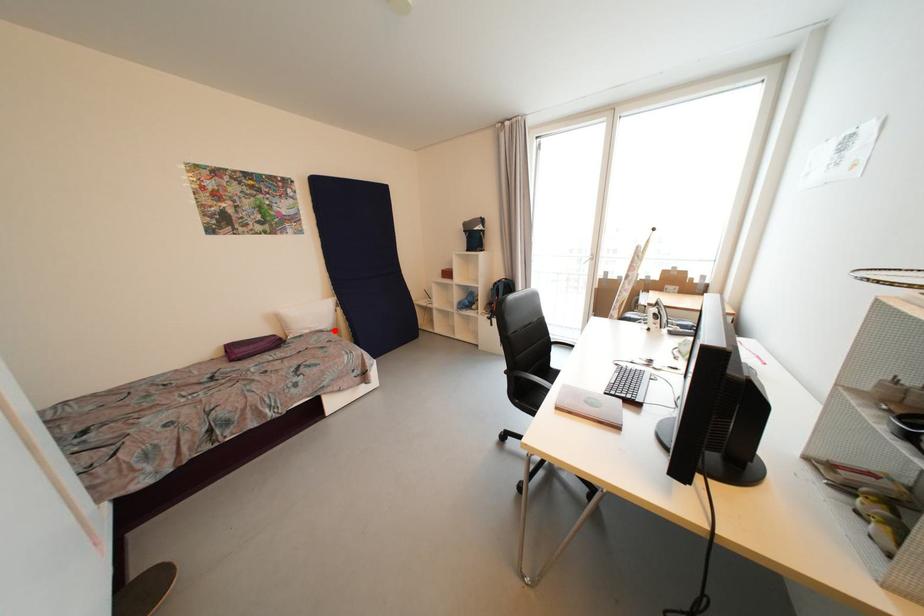
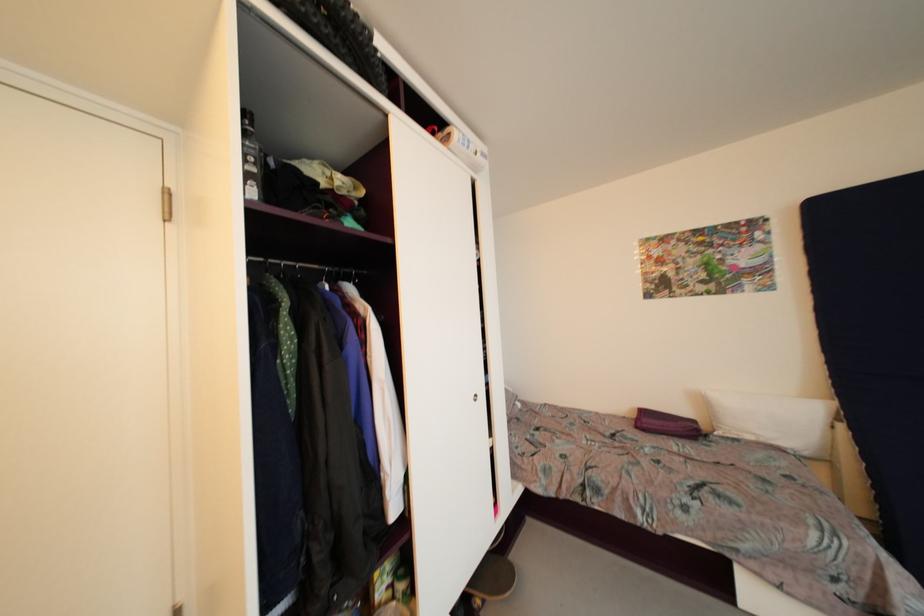
Locate, in the second image, the point that corresponds to the highlighted location in the first image.

(810, 456)